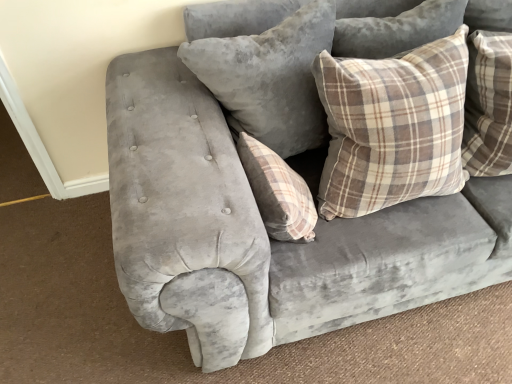
Question: Could you tell me if plush gray pillow at upper center, which appears as the 3th pillow when viewed from the right, is facing brown plaid pillow at upper right, which is the third pillow in left-to-right order?

Choices:
 (A) no
 (B) yes

Answer: (B)

Question: From the image's perspective, does plush gray pillow at upper center, the first pillow when ordered from left to right, appear higher than brown plaid pillow at upper right, which is the third pillow in left-to-right order?

Choices:
 (A) no
 (B) yes

Answer: (B)

Question: Does plush gray pillow at upper center, which appears as the 3th pillow when viewed from the right, have a larger size compared to brown plaid pillow at upper right, which is the third pillow in left-to-right order?

Choices:
 (A) yes
 (B) no

Answer: (A)

Question: Is there a large distance between plush gray pillow at upper center, the first pillow when ordered from left to right, and brown plaid pillow at upper right, the first pillow in the right-to-left sequence?

Choices:
 (A) no
 (B) yes

Answer: (A)

Question: Can you confirm if plush gray pillow at upper center, which appears as the 3th pillow when viewed from the right, is positioned to the left of brown plaid pillow at upper right, the first pillow in the right-to-left sequence?

Choices:
 (A) yes
 (B) no

Answer: (A)

Question: Based on their positions, is brown plaid pillow at upper right, the first pillow in the right-to-left sequence, located to the left or right of plaid fabric pillow at center, the second pillow positioned from the left?

Choices:
 (A) left
 (B) right

Answer: (B)

Question: Choose the correct answer: Is brown plaid pillow at upper right, the first pillow in the right-to-left sequence, inside plaid fabric pillow at center, which is the 2th pillow from right to left, or outside it?

Choices:
 (A) inside
 (B) outside

Answer: (B)

Question: Considering the positions of brown plaid pillow at upper right, which is the third pillow in left-to-right order, and plaid fabric pillow at center, which is the 2th pillow from right to left, in the image, is brown plaid pillow at upper right, which is the third pillow in left-to-right order, bigger or smaller than plaid fabric pillow at center, which is the 2th pillow from right to left,?

Choices:
 (A) big
 (B) small

Answer: (A)

Question: Looking at their shapes, would you say brown plaid pillow at upper right, which is the third pillow in left-to-right order, is wider or thinner than plaid fabric pillow at center, which is the 2th pillow from right to left?

Choices:
 (A) wide
 (B) thin

Answer: (A)

Question: From the image's perspective, relative to plaid fabric pillow at center, the second pillow positioned from the left, is plush gray pillow at upper center, the first pillow when ordered from left to right, above or below?

Choices:
 (A) above
 (B) below

Answer: (A)

Question: Is plush gray pillow at upper center, which appears as the 3th pillow when viewed from the right, to the left or to the right of plaid fabric pillow at center, the second pillow positioned from the left, in the image?

Choices:
 (A) left
 (B) right

Answer: (A)

Question: Does point (309, 84) appear closer or farther from the camera than point (269, 175)?

Choices:
 (A) closer
 (B) farther

Answer: (B)

Question: From their relative heights in the image, would you say plush gray pillow at upper center, the first pillow when ordered from left to right, is taller or shorter than plaid fabric pillow at center, which is the 2th pillow from right to left?

Choices:
 (A) short
 (B) tall

Answer: (B)

Question: Considering the positions of plush gray pillow at upper center, which appears as the 3th pillow when viewed from the right, and brown plaid pillow at upper right, the first pillow in the right-to-left sequence, in the image, is plush gray pillow at upper center, which appears as the 3th pillow when viewed from the right, wider or thinner than brown plaid pillow at upper right, the first pillow in the right-to-left sequence,?

Choices:
 (A) wide
 (B) thin

Answer: (A)

Question: In the image, is plush gray pillow at upper center, the first pillow when ordered from left to right, positioned in front of or behind brown plaid pillow at upper right, the first pillow in the right-to-left sequence?

Choices:
 (A) behind
 (B) front

Answer: (A)